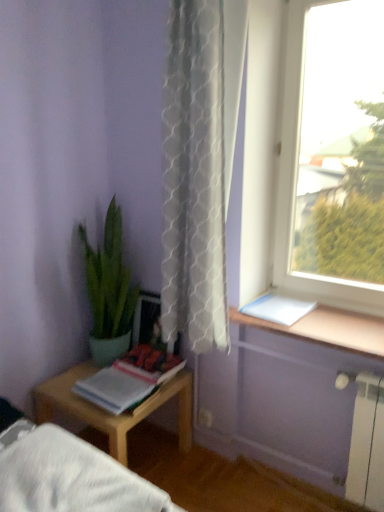
Question: Is transparent glass window at upper right with wooden table at left?

Choices:
 (A) yes
 (B) no

Answer: (B)

Question: Does transparent glass window at upper right have a greater width compared to wooden table at left?

Choices:
 (A) no
 (B) yes

Answer: (A)

Question: From the image's perspective, would you say transparent glass window at upper right is positioned over wooden table at left?

Choices:
 (A) no
 (B) yes

Answer: (B)

Question: Is transparent glass window at upper right positioned before wooden table at left?

Choices:
 (A) yes
 (B) no

Answer: (A)

Question: Would you say transparent glass window at upper right contains wooden table at left?

Choices:
 (A) no
 (B) yes

Answer: (A)

Question: From the image's perspective, is matte paper book at lower left, placed as the second book when sorted from top to bottom, above or below wooden table at left?

Choices:
 (A) above
 (B) below

Answer: (A)

Question: Is matte paper book at lower left, the 2th book viewed from the right, inside the boundaries of wooden table at left, or outside?

Choices:
 (A) inside
 (B) outside

Answer: (B)

Question: From their relative heights in the image, would you say matte paper book at lower left, which ranks as the 1th book in bottom-to-top order, is taller or shorter than wooden table at left?

Choices:
 (A) tall
 (B) short

Answer: (B)

Question: Looking at their shapes, would you say matte paper book at lower left, the 2th book viewed from the right, is wider or thinner than wooden table at left?

Choices:
 (A) thin
 (B) wide

Answer: (A)

Question: Is white paper at upper right, the second book positioned from the bottom, wider or thinner than wooden table at left?

Choices:
 (A) wide
 (B) thin

Answer: (B)

Question: Considering the positions of white paper at upper right, the first book positioned from the right, and wooden table at left in the image, is white paper at upper right, the first book positioned from the right, taller or shorter than wooden table at left?

Choices:
 (A) short
 (B) tall

Answer: (A)

Question: Is white paper at upper right, marked as the first book in a top-to-bottom arrangement, bigger or smaller than wooden table at left?

Choices:
 (A) big
 (B) small

Answer: (B)

Question: In the image, is white paper at upper right, the first book positioned from the right, positioned in front of or behind wooden table at left?

Choices:
 (A) behind
 (B) front

Answer: (A)

Question: Is point (142, 350) positioned closer to the camera than point (283, 315)?

Choices:
 (A) closer
 (B) farther

Answer: (B)

Question: Looking at their shapes, would you say matte paper book at lower left, the 2th book viewed from the right, is wider or thinner than white paper at upper right, the second book positioned from the bottom?

Choices:
 (A) thin
 (B) wide

Answer: (B)